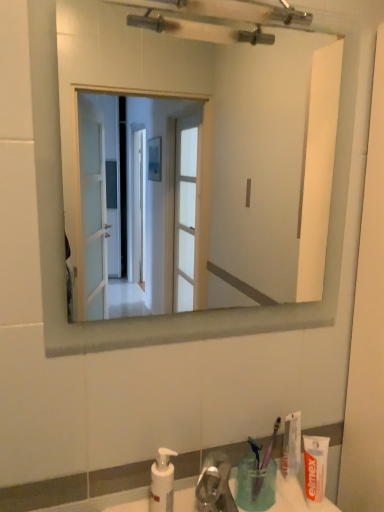
Describe the element at coordinates (198, 157) in the screenshot. The width and height of the screenshot is (384, 512). I see `white glossy mirror at upper center` at that location.

The height and width of the screenshot is (512, 384). In order to click on white glossy mirror at upper center in this screenshot , I will do `click(198, 157)`.

Measure the distance between white matte toothpaste at lower right, the 1th toothpaste viewed from the back, and camera.

white matte toothpaste at lower right, the 1th toothpaste viewed from the back, is 37.42 inches from camera.

Identify the location of blue plastic toothbrush at lower center, the 1th toothbrush from the left. Image resolution: width=384 pixels, height=512 pixels. (255, 451).

The image size is (384, 512). In order to click on purple plastic toothbrush at lower right, which appears as the 1th toothbrush when viewed from the right in this screenshot , I will do `click(270, 445)`.

This screenshot has height=512, width=384. What do you see at coordinates (255, 485) in the screenshot?
I see `translucent plastic cup at lower right` at bounding box center [255, 485].

Where is `white glossy mirror at upper center`? The height and width of the screenshot is (512, 384). white glossy mirror at upper center is located at coordinates pyautogui.click(x=198, y=157).

From a real-world perspective, is white glossy mirror at upper center beneath purple plastic toothbrush at lower right, which appears as the 1th toothbrush when viewed from the right?

Answer: Incorrect, from a real-world perspective, white glossy mirror at upper center is higher than purple plastic toothbrush at lower right, which appears as the 1th toothbrush when viewed from the right.

Is white glossy mirror at upper center facing towards purple plastic toothbrush at lower right, which appears as the 1th toothbrush when viewed from the right?

No.

Can you tell me how much white glossy mirror at upper center and purple plastic toothbrush at lower right, acting as the 2th toothbrush starting from the left, differ in facing direction?

The facing directions of white glossy mirror at upper center and purple plastic toothbrush at lower right, acting as the 2th toothbrush starting from the left, are 1.52 degrees apart.

Can we say blue plastic toothbrush at lower center, the 1th toothbrush from the left, lies outside white glossy mirror at upper center?

blue plastic toothbrush at lower center, the 1th toothbrush from the left, is positioned outside white glossy mirror at upper center.

Is blue plastic toothbrush at lower center, which appears as the second toothbrush when viewed from the right, positioned behind white glossy mirror at upper center?

Yes, blue plastic toothbrush at lower center, which appears as the second toothbrush when viewed from the right, is further from the camera.

Identify the location of mirror above the blue plastic toothbrush at lower center, the 1th toothbrush from the left (from the image's perspective). (198, 157).

Which of these two, blue plastic toothbrush at lower center, which appears as the second toothbrush when viewed from the right, or white glossy mirror at upper center, is smaller?

Smaller between the two is blue plastic toothbrush at lower center, which appears as the second toothbrush when viewed from the right.

Which object is thinner, translucent plastic cup at lower right or white matte toothpaste at lower right, the first toothpaste when ordered from front to back?

white matte toothpaste at lower right, the first toothpaste when ordered from front to back, is thinner.

Can white matte toothpaste at lower right, which appears as the second toothpaste when viewed from the back, be found inside translucent plastic cup at lower right?

Definitely not — white matte toothpaste at lower right, which appears as the second toothpaste when viewed from the back, is not inside translucent plastic cup at lower right.

Consider the image. From the image's perspective, which one is positioned higher, translucent plastic cup at lower right or white matte toothpaste at lower right, which appears as the second toothpaste when viewed from the back?

white matte toothpaste at lower right, which appears as the second toothpaste when viewed from the back.

From a real-world perspective, is translucent plastic cup at lower right on white matte toothpaste at lower right, the first toothpaste when ordered from front to back?

No, from a real-world perspective, translucent plastic cup at lower right is not above white matte toothpaste at lower right, the first toothpaste when ordered from front to back.

Is white plastic soap dispenser at lower center at the left side of white matte toothpaste at lower right, which appears as the second toothpaste when viewed from the back?

Yes, white plastic soap dispenser at lower center is to the left of white matte toothpaste at lower right, which appears as the second toothpaste when viewed from the back.

From the image's perspective, who appears lower, white plastic soap dispenser at lower center or white matte toothpaste at lower right, the first toothpaste when ordered from front to back?

white plastic soap dispenser at lower center appears lower in the image.

Looking at this image, is white plastic soap dispenser at lower center further to camera compared to white matte toothpaste at lower right, the first toothpaste when ordered from front to back?

No, it is not.

Does point (165, 474) come in front of point (314, 459)?

Yes, point (165, 474) is in front of point (314, 459).

From the image's perspective, is white matte toothpaste at lower right, which appears as the second toothpaste when viewed from the back, under white matte toothpaste at lower right, the 1th toothpaste viewed from the back?

Yes, from the image's perspective, white matte toothpaste at lower right, which appears as the second toothpaste when viewed from the back, is below white matte toothpaste at lower right, the 1th toothpaste viewed from the back.

Is white matte toothpaste at lower right, which appears as the second toothpaste when viewed from the back, to the left or to the right of white matte toothpaste at lower right, the 1th toothpaste viewed from the back, in the image?

Based on their positions, white matte toothpaste at lower right, which appears as the second toothpaste when viewed from the back, is located to the right of white matte toothpaste at lower right, the 1th toothpaste viewed from the back.

Would you say white matte toothpaste at lower right, the first toothpaste when ordered from front to back, is a long distance from white matte toothpaste at lower right, positioned as the 2th toothpaste in front-to-back order?

No, there isn't a large distance between white matte toothpaste at lower right, the first toothpaste when ordered from front to back, and white matte toothpaste at lower right, positioned as the 2th toothpaste in front-to-back order.

Does point (317, 483) appear closer or farther from the camera than point (283, 444)?

Clearly, point (317, 483) is closer to the camera than point (283, 444).

Based on the photo, which of these two, blue plastic toothbrush at lower center, the 1th toothbrush from the left, or purple plastic toothbrush at lower right, which appears as the 1th toothbrush when viewed from the right, is smaller?

Smaller between the two is blue plastic toothbrush at lower center, the 1th toothbrush from the left.

Can you confirm if blue plastic toothbrush at lower center, the 1th toothbrush from the left, is positioned to the left of purple plastic toothbrush at lower right, acting as the 2th toothbrush starting from the left?

Indeed, blue plastic toothbrush at lower center, the 1th toothbrush from the left, is positioned on the left side of purple plastic toothbrush at lower right, acting as the 2th toothbrush starting from the left.

Measure the distance between blue plastic toothbrush at lower center, the 1th toothbrush from the left, and white plastic soap dispenser at lower center.

The distance of blue plastic toothbrush at lower center, the 1th toothbrush from the left, from white plastic soap dispenser at lower center is 21.44 centimeters.

Which object is thinner, blue plastic toothbrush at lower center, which appears as the second toothbrush when viewed from the right, or white plastic soap dispenser at lower center?

blue plastic toothbrush at lower center, which appears as the second toothbrush when viewed from the right, is thinner.

From the image's perspective, is blue plastic toothbrush at lower center, the 1th toothbrush from the left, located beneath white plastic soap dispenser at lower center?

Actually, blue plastic toothbrush at lower center, the 1th toothbrush from the left, appears above white plastic soap dispenser at lower center in the image.

From a real-world perspective, between blue plastic toothbrush at lower center, the 1th toothbrush from the left, and white plastic soap dispenser at lower center, who is vertically higher?

In real-world perspective, white plastic soap dispenser at lower center is above.

From a real-world perspective, which toothbrush is the 1st one underneath the white glossy mirror at upper center? Please provide its 2D coordinates.

[(270, 445)]

Image resolution: width=384 pixels, height=512 pixels. In order to click on mirror located on the left of blue plastic toothbrush at lower center, the 1th toothbrush from the left in this screenshot , I will do `click(198, 157)`.

Based on the photo, when comparing their distances from white matte toothpaste at lower right, the 1th toothpaste viewed from the back, does white matte toothpaste at lower right, which appears as the second toothpaste when viewed from the back, or translucent plastic cup at lower right seem closer?

Among the two, white matte toothpaste at lower right, which appears as the second toothpaste when viewed from the back, is located nearer to white matte toothpaste at lower right, the 1th toothpaste viewed from the back.

Looking at the image, which one is located further to white plastic soap dispenser at lower center, purple plastic toothbrush at lower right, acting as the 2th toothbrush starting from the left, or white matte toothpaste at lower right, the first toothpaste when ordered from front to back?

white matte toothpaste at lower right, the first toothpaste when ordered from front to back, is further to white plastic soap dispenser at lower center.

Looking at this image, based on their spatial positions, is white plastic soap dispenser at lower center or translucent plastic cup at lower right further from white glossy mirror at upper center?

Based on the image, white plastic soap dispenser at lower center appears to be further to white glossy mirror at upper center.

From the image, which object appears to be nearer to blue plastic toothbrush at lower center, which appears as the second toothbrush when viewed from the right, white plastic soap dispenser at lower center or white matte toothpaste at lower right, the first toothpaste when ordered from front to back?

The object closer to blue plastic toothbrush at lower center, which appears as the second toothbrush when viewed from the right, is white matte toothpaste at lower right, the first toothpaste when ordered from front to back.

From the picture: Looking at the image, which one is located further to white plastic soap dispenser at lower center, translucent plastic cup at lower right or white matte toothpaste at lower right, the 1th toothpaste viewed from the back?

Among the two, white matte toothpaste at lower right, the 1th toothpaste viewed from the back, is located further to white plastic soap dispenser at lower center.

When comparing their distances from translucent plastic cup at lower right, does white matte toothpaste at lower right, positioned as the 2th toothpaste in front-to-back order, or white glossy mirror at upper center seem closer?

The object closer to translucent plastic cup at lower right is white matte toothpaste at lower right, positioned as the 2th toothpaste in front-to-back order.

When comparing their distances from white matte toothpaste at lower right, positioned as the 2th toothpaste in front-to-back order, does white glossy mirror at upper center or purple plastic toothbrush at lower right, which appears as the 1th toothbrush when viewed from the right, seem further?

Among the two, white glossy mirror at upper center is located further to white matte toothpaste at lower right, positioned as the 2th toothpaste in front-to-back order.

Looking at the image, which one is located further to purple plastic toothbrush at lower right, acting as the 2th toothbrush starting from the left, white matte toothpaste at lower right, the first toothpaste when ordered from front to back, or white plastic soap dispenser at lower center?

white plastic soap dispenser at lower center.

What are the coordinates of `toothbrush between white plastic soap dispenser at lower center and purple plastic toothbrush at lower right, which appears as the 1th toothbrush when viewed from the right` in the screenshot? It's located at (255, 451).

Find the location of `toothbrush between white plastic soap dispenser at lower center and translucent plastic cup at lower right in the horizontal direction`. toothbrush between white plastic soap dispenser at lower center and translucent plastic cup at lower right in the horizontal direction is located at coordinates (255, 451).

This screenshot has height=512, width=384. Identify the location of toothbrush between white glossy mirror at upper center and white matte toothpaste at lower right, the first toothpaste when ordered from front to back, vertically. click(270, 445).

I want to click on soap dispenser between white glossy mirror at upper center and translucent plastic cup at lower right in the up-down direction, so click(162, 482).